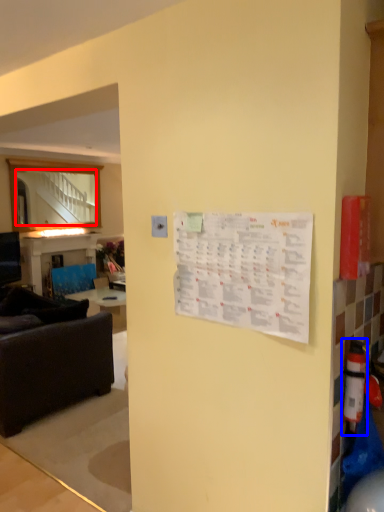
Question: Which point is further to the camera, mirror (highlighted by a red box) or extinguisher (highlighted by a blue box)?

Choices:
 (A) mirror
 (B) extinguisher

Answer: (A)